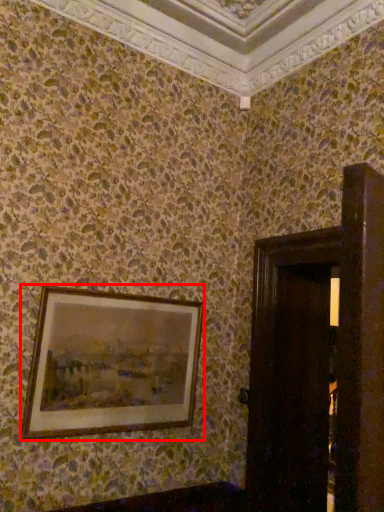
Question: From the image's perspective, where is picture frame (annotated by the red box) located in relation to door in the image?

Choices:
 (A) below
 (B) above

Answer: (B)